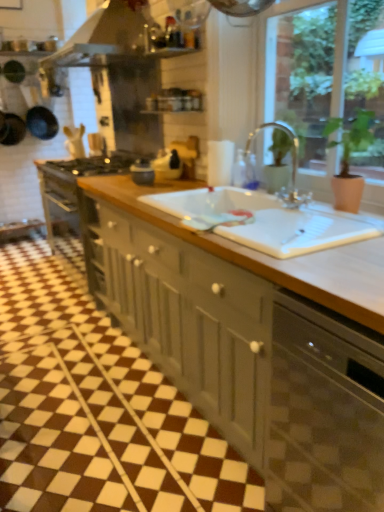
Question: Considering the relative sizes of matte gray cabinets at center and green matte plant at upper right in the image provided, is matte gray cabinets at center bigger than green matte plant at upper right?

Choices:
 (A) no
 (B) yes

Answer: (B)

Question: Does matte gray cabinets at center turn towards green matte plant at upper right?

Choices:
 (A) no
 (B) yes

Answer: (A)

Question: From the image's perspective, is matte gray cabinets at center below green matte plant at upper right?

Choices:
 (A) no
 (B) yes

Answer: (B)

Question: Is matte gray cabinets at center positioned in front of green matte plant at upper right?

Choices:
 (A) no
 (B) yes

Answer: (B)

Question: Is matte gray cabinets at center to the right of green matte plant at upper right from the viewer's perspective?

Choices:
 (A) no
 (B) yes

Answer: (A)

Question: From the image's perspective, is metallic silver exhaust hood at upper center located above or below green matte plant at upper right?

Choices:
 (A) above
 (B) below

Answer: (A)

Question: Based on their positions, is metallic silver exhaust hood at upper center located to the left or right of green matte plant at upper right?

Choices:
 (A) right
 (B) left

Answer: (B)

Question: From a real-world perspective, relative to green matte plant at upper right, is metallic silver exhaust hood at upper center vertically above or below?

Choices:
 (A) below
 (B) above

Answer: (B)

Question: Is metallic silver exhaust hood at upper center situated inside green matte plant at upper right or outside?

Choices:
 (A) inside
 (B) outside

Answer: (B)

Question: Would you say clear glass faucet at upper center is inside or outside matte gray cabinets at center?

Choices:
 (A) outside
 (B) inside

Answer: (A)

Question: Visually, is clear glass faucet at upper center positioned to the left or to the right of matte gray cabinets at center?

Choices:
 (A) left
 (B) right

Answer: (B)

Question: Considering the positions of clear glass faucet at upper center and matte gray cabinets at center in the image, is clear glass faucet at upper center taller or shorter than matte gray cabinets at center?

Choices:
 (A) short
 (B) tall

Answer: (A)

Question: Considering their positions, is clear glass faucet at upper center located in front of or behind matte gray cabinets at center?

Choices:
 (A) behind
 (B) front

Answer: (A)

Question: Would you say matte gray cabinets at center is to the left or to the right of green matte plant at upper right in the picture?

Choices:
 (A) right
 (B) left

Answer: (B)

Question: In the image, is matte gray cabinets at center positioned in front of or behind green matte plant at upper right?

Choices:
 (A) front
 (B) behind

Answer: (A)